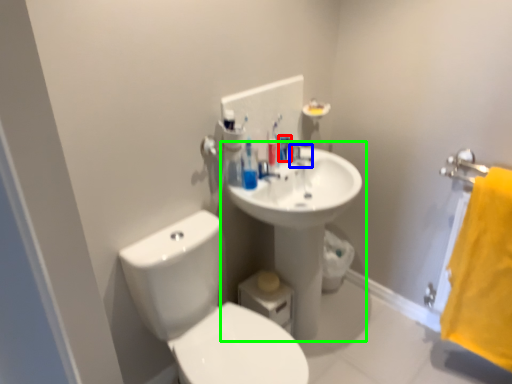
Question: Which object is the closest to the mouthwash (highlighted by a red box)? Choose among these: plumbing fixture (highlighted by a blue box) or sink (highlighted by a green box).

Choices:
 (A) plumbing fixture
 (B) sink

Answer: (A)